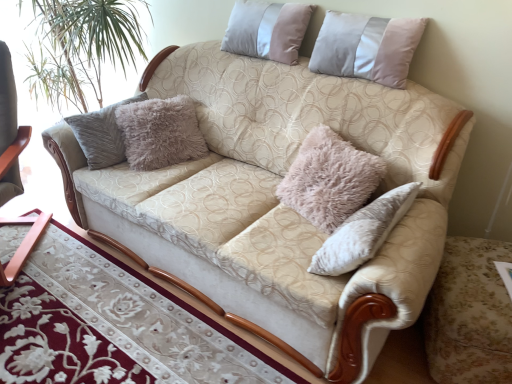
Question: Is the position of wooden table at lower left more distant than that of wooden rocking chair at left?

Choices:
 (A) yes
 (B) no

Answer: (B)

Question: Is wooden table at lower left next to wooden rocking chair at left and touching it?

Choices:
 (A) yes
 (B) no

Answer: (B)

Question: Is wooden table at lower left far from wooden rocking chair at left?

Choices:
 (A) yes
 (B) no

Answer: (B)

Question: From the image's perspective, is wooden table at lower left under wooden rocking chair at left?

Choices:
 (A) yes
 (B) no

Answer: (A)

Question: Does wooden table at lower left have a lesser width compared to wooden rocking chair at left?

Choices:
 (A) yes
 (B) no

Answer: (A)

Question: Considering the relative sizes of wooden table at lower left and wooden rocking chair at left in the image provided, is wooden table at lower left bigger than wooden rocking chair at left?

Choices:
 (A) yes
 (B) no

Answer: (B)

Question: Can you confirm if pale pink velvet pillow at upper right, marked as the first pillow in a right-to-left arrangement, is taller than silky beige pillow at upper center, placed as the second pillow when sorted from right to left?

Choices:
 (A) no
 (B) yes

Answer: (B)

Question: From the image's perspective, is pale pink velvet pillow at upper right, marked as the second pillow in a left-to-right arrangement, on top of silky beige pillow at upper center, placed as the second pillow when sorted from right to left?

Choices:
 (A) yes
 (B) no

Answer: (B)

Question: Is pale pink velvet pillow at upper right, marked as the first pillow in a right-to-left arrangement, oriented towards silky beige pillow at upper center, the first pillow viewed from the left?

Choices:
 (A) no
 (B) yes

Answer: (A)

Question: Does pale pink velvet pillow at upper right, marked as the second pillow in a left-to-right arrangement, have a greater width compared to silky beige pillow at upper center, the first pillow viewed from the left?

Choices:
 (A) yes
 (B) no

Answer: (A)

Question: Is pale pink velvet pillow at upper right, marked as the first pillow in a right-to-left arrangement, smaller than silky beige pillow at upper center, the first pillow viewed from the left?

Choices:
 (A) yes
 (B) no

Answer: (B)

Question: From the image's perspective, would you say pale pink velvet pillow at upper right, marked as the first pillow in a right-to-left arrangement, is shown under silky beige pillow at upper center, the first pillow viewed from the left?

Choices:
 (A) yes
 (B) no

Answer: (A)

Question: From a real-world perspective, is wooden table at lower left physically above pale pink velvet pillow at upper right, marked as the second pillow in a left-to-right arrangement?

Choices:
 (A) yes
 (B) no

Answer: (B)